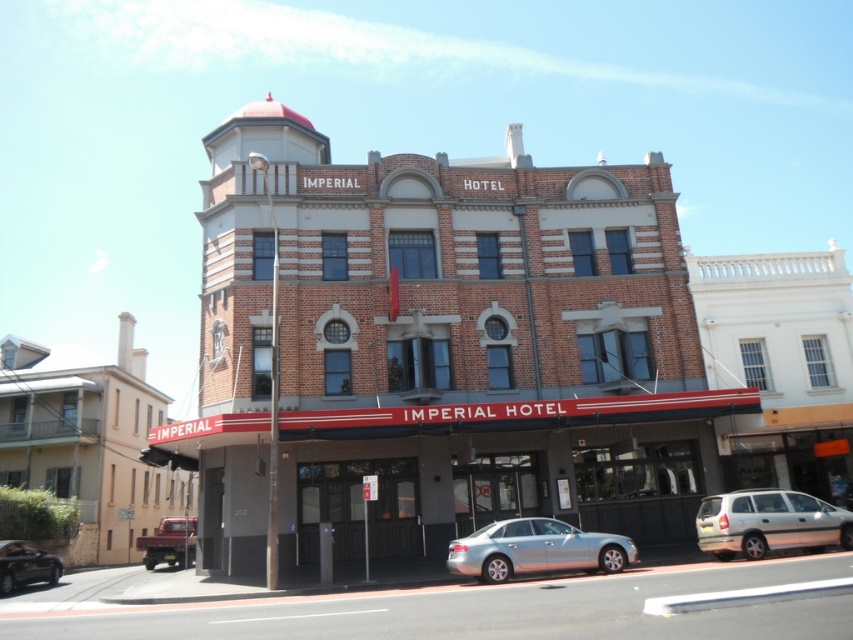
You are a delivery driver who needs to park your metallic silver sedan at lower left closer to the brown brick building at center. Given that your parking space must be within 10 meters of the building, can you park your car in the current location?

The distance between the brown brick building at center and the metallic silver sedan at lower left is 15.70 meters, which exceeds the 10 meter requirement. Therefore, you cannot park the metallic silver sedan at lower left in its current location as it is too far from the brown brick building at center.

You are a delivery person arriving at the Imperial Hotel. You need to park your vehicle in the parking lot behind the hotel. However, your truck is currently blocking the silver metallic sedan at lower center. Can you move the metallic maroon truck at lower left out of the way to allow the sedan to exit?

The silver metallic sedan at lower center is in front of the metallic maroon truck at lower left, so the sedan cannot exit until the truck moves first. Therefore, you need to move the metallic maroon truck at lower left to allow the sedan to exit.

You are standing in front of the Imperial Hotel and notice a beige brick building at lower left and a metallic maroon truck at lower left. Which one is wider?

The beige brick building at lower left is wider than the metallic maroon truck at lower left.